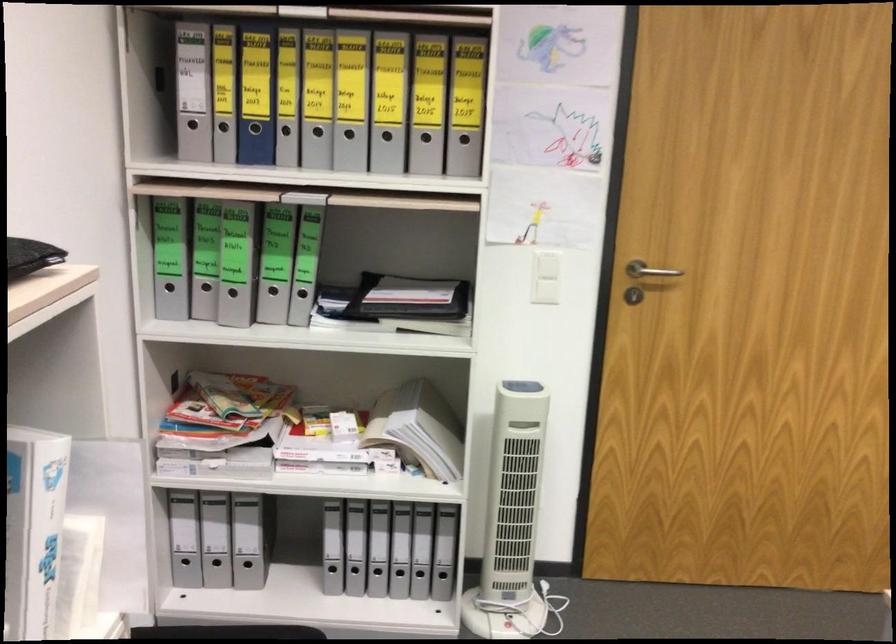
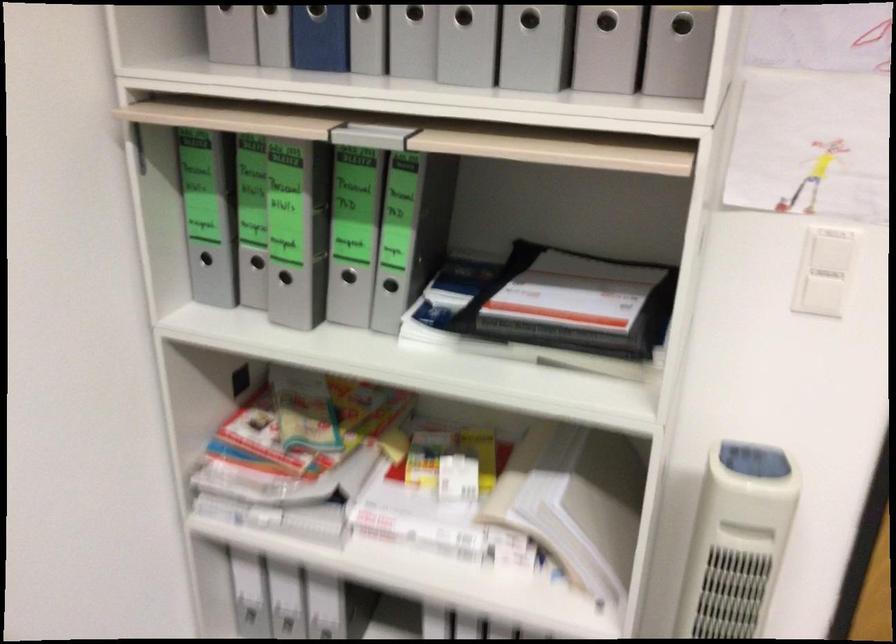
Question: In a continuous first-person perspective shot, in which direction is the camera moving?

Choices:
 (A) Left
 (B) Right
 (C) Forward
 (D) Backward

Answer: (C)